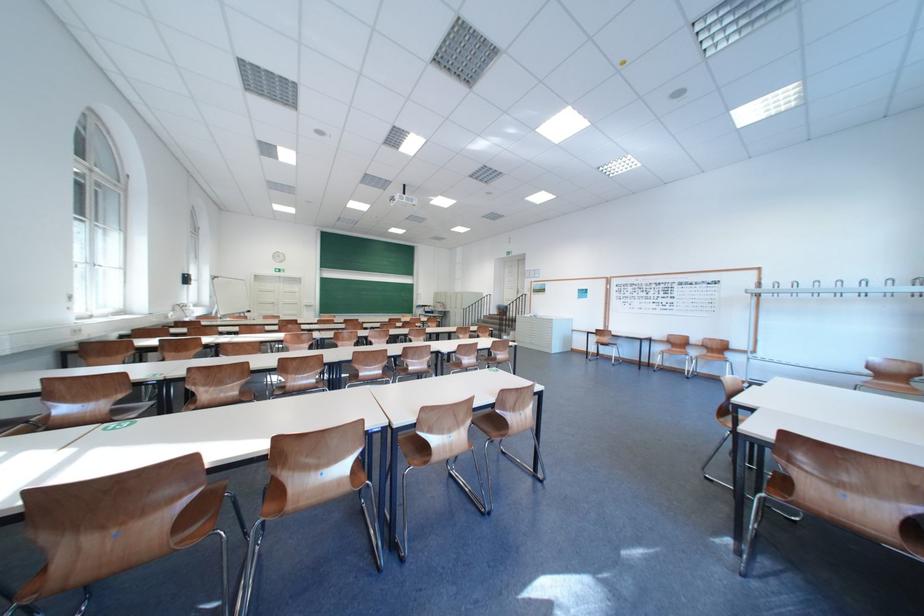
The height and width of the screenshot is (616, 924). In order to click on metal coat hook in this screenshot , I will do `click(842, 289)`.